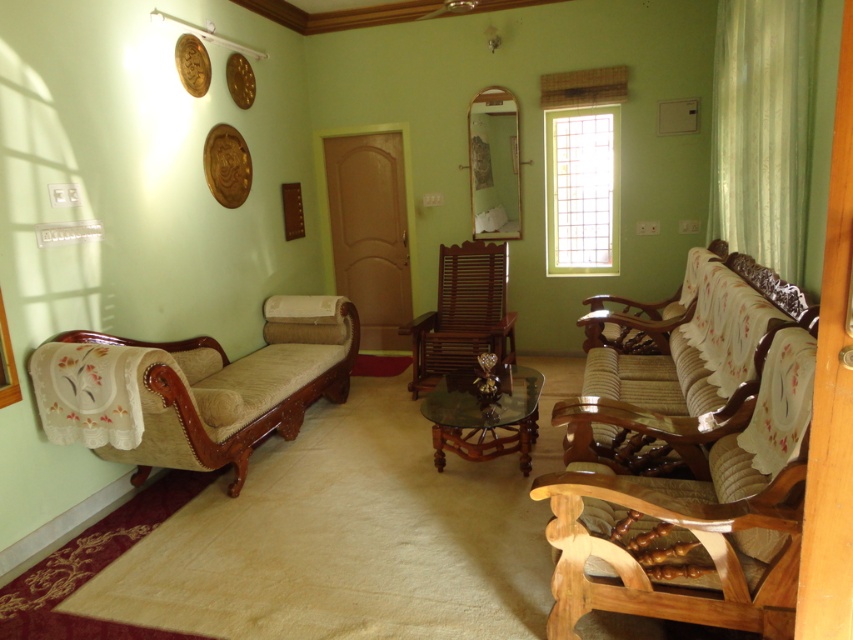
Question: Does beige fabric daybed at left appear under transparent glass table at center?

Choices:
 (A) yes
 (B) no

Answer: (B)

Question: Estimate the real-world distances between objects in this image. Which object is closer to the wooden couch at right?

Choices:
 (A) transparent glass table at center
 (B) beige fabric daybed at left
 (C) green sheer curtain at right
 (D) mahogany wood rocking chair at center

Answer: (A)

Question: Is wooden couch at right closer to the viewer compared to green sheer curtain at right?

Choices:
 (A) yes
 (B) no

Answer: (A)

Question: In this image, where is beige fabric daybed at left located relative to wooden couch at right?

Choices:
 (A) left
 (B) right

Answer: (A)

Question: Among these points, which one is nearest to the camera?

Choices:
 (A) (561, 413)
 (B) (456, 372)
 (C) (178, 449)

Answer: (A)

Question: Considering the real-world distances, which object is farthest from the wooden couch at right?

Choices:
 (A) transparent glass table at center
 (B) green sheer curtain at right
 (C) beige fabric daybed at left

Answer: (C)